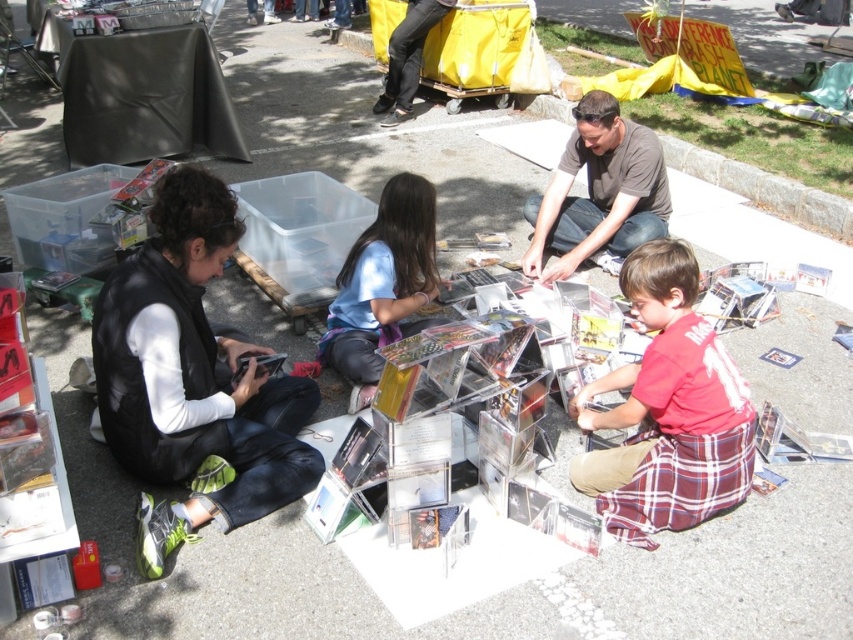
Is black leather vest at lower left thinner than blue matte shirt at center?

No, black leather vest at lower left is not thinner than blue matte shirt at center.

Based on the photo, measure the distance between black leather vest at lower left and camera.

A distance of 2.27 meters exists between black leather vest at lower left and camera.

Between point (296, 397) and point (335, 324), which one is positioned in front?

Point (296, 397) is more forward.

You are a GUI agent. You are given a task and a screenshot of the screen. Output one action in this format:
    pyautogui.click(x=<x>, y=<y>)
    Task: Click on the black leather vest at lower left
    This screenshot has width=853, height=640.
    Given the screenshot: What is the action you would take?
    pos(192,378)

Where is `matte brown shirt at center`? The image size is (853, 640). matte brown shirt at center is located at coordinates (599, 192).

Does matte brown shirt at center have a smaller size compared to blue matte shirt at center?

No, matte brown shirt at center is not smaller than blue matte shirt at center.

Measure the distance between matte brown shirt at center and camera.

The distance of matte brown shirt at center from camera is 3.64 meters.

Image resolution: width=853 pixels, height=640 pixels. What are the coordinates of `matte brown shirt at center` in the screenshot? It's located at (599, 192).

Is red plaid shorts at lower right in front of blue matte shirt at center?

Yes.

Is the position of red plaid shorts at lower right more distant than that of blue matte shirt at center?

No, it is in front of blue matte shirt at center.

I want to click on red plaid shorts at lower right, so click(668, 410).